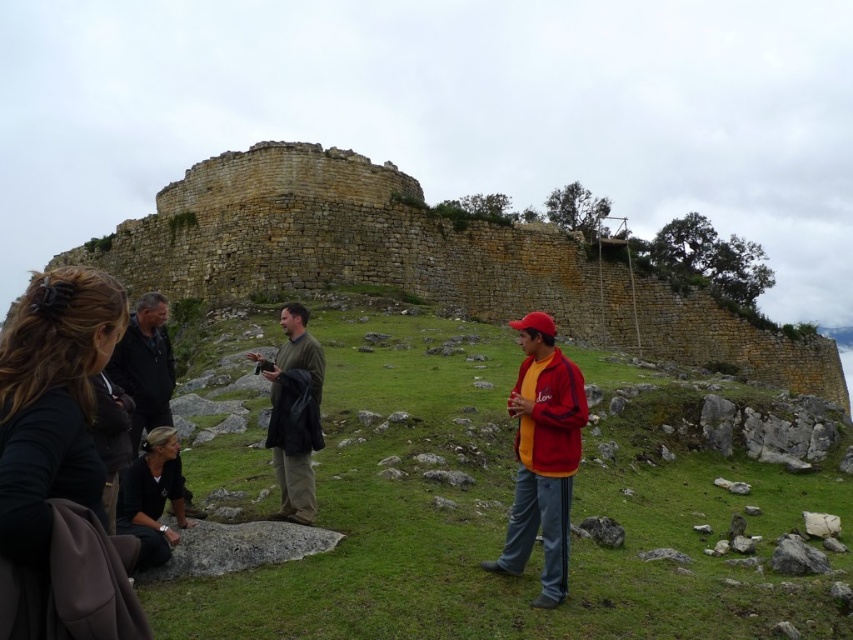
Question: Is green matte shirt at center bigger than dark gray jacket at center?

Choices:
 (A) no
 (B) yes

Answer: (A)

Question: Which is farther from the matte red jacket at center?

Choices:
 (A) black fabric shirt at lower left
 (B) green grass at center
 (C) black fabric bag at lower left
 (D) yellow stone wall at upper center

Answer: (D)

Question: Estimate the real-world distances between objects in this image. Which object is closer to the green grass at center?

Choices:
 (A) matte red jacket at center
 (B) yellow stone wall at upper center
 (C) green matte shirt at center

Answer: (A)

Question: Does matte red jacket at center appear on the right side of dark gray jacket at center?

Choices:
 (A) yes
 (B) no

Answer: (A)

Question: Which object is positioned closest to the green matte shirt at center?

Choices:
 (A) black fabric bag at lower left
 (B) black fabric shirt at lower left
 (C) green grass at center

Answer: (C)

Question: Is green grass at center further to camera compared to green matte shirt at center?

Choices:
 (A) no
 (B) yes

Answer: (A)